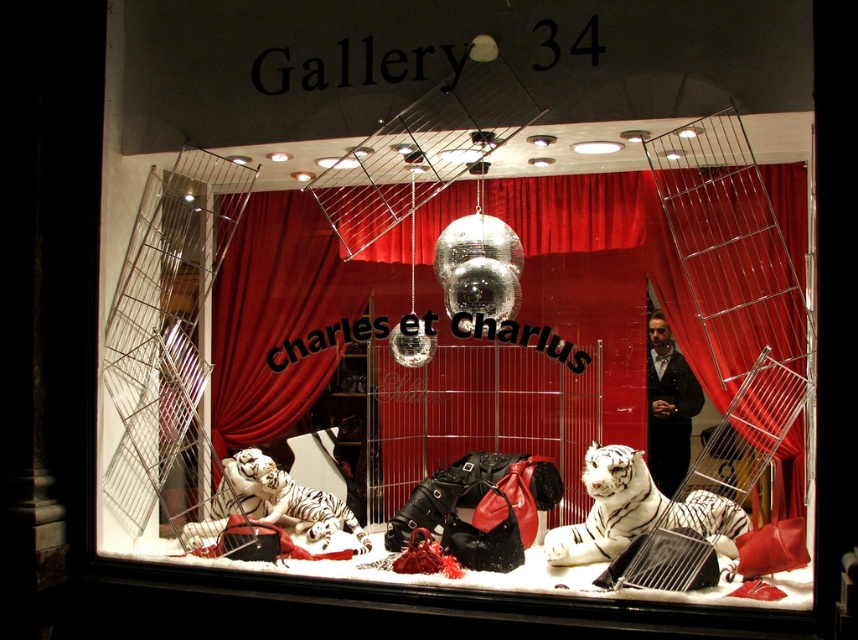
Between white fur tiger at center and white ceramic tiger at lower left, which one is positioned lower?

Positioned lower is white ceramic tiger at lower left.

Does white fur tiger at center have a greater width compared to white ceramic tiger at lower left?

Indeed, white fur tiger at center has a greater width compared to white ceramic tiger at lower left.

You are a GUI agent. You are given a task and a screenshot of the screen. Output one action in this format:
    pyautogui.click(x=<x>, y=<y>)
    Task: Click on the white fur tiger at center
    This screenshot has width=858, height=640.
    Given the screenshot: What is the action you would take?
    pyautogui.click(x=636, y=509)